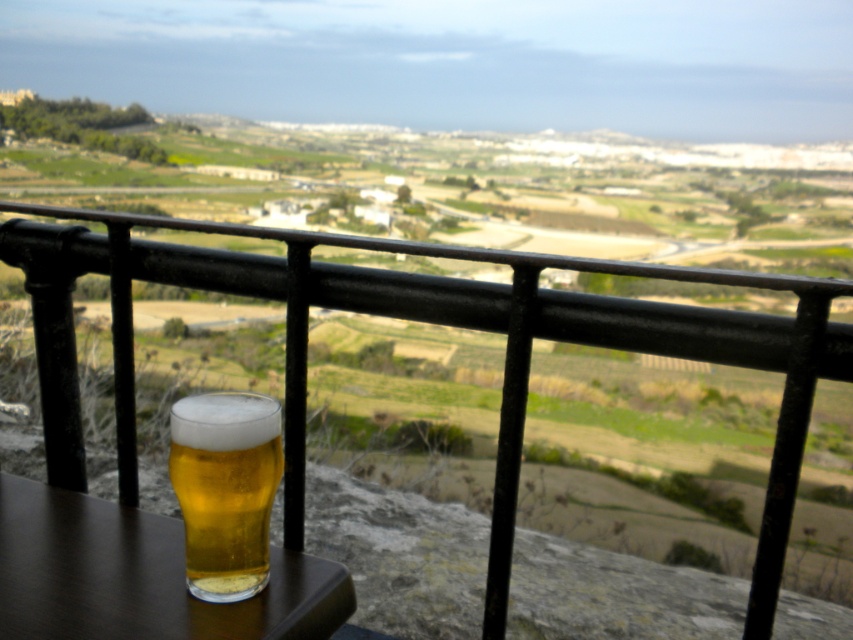
Question: Is black metal railing at upper center thinner than golden glass beer at lower left?

Choices:
 (A) no
 (B) yes

Answer: (A)

Question: Among these objects, which one is farthest from the camera?

Choices:
 (A) golden glass beer at lower left
 (B) black metal railing at upper center
 (C) brown wood table at lower left

Answer: (B)

Question: Which object is positioned farthest from the brown wood table at lower left?

Choices:
 (A) golden glass beer at lower left
 (B) black metal railing at upper center

Answer: (B)

Question: Observing the image, what is the correct spatial positioning of brown wood table at lower left in reference to golden glass beer at lower left?

Choices:
 (A) below
 (B) above

Answer: (A)

Question: Is black metal railing at upper center behind golden glass beer at lower left?

Choices:
 (A) yes
 (B) no

Answer: (A)

Question: Which point is farther to the camera?

Choices:
 (A) (386, 308)
 (B) (131, 570)
 (C) (247, 488)

Answer: (A)